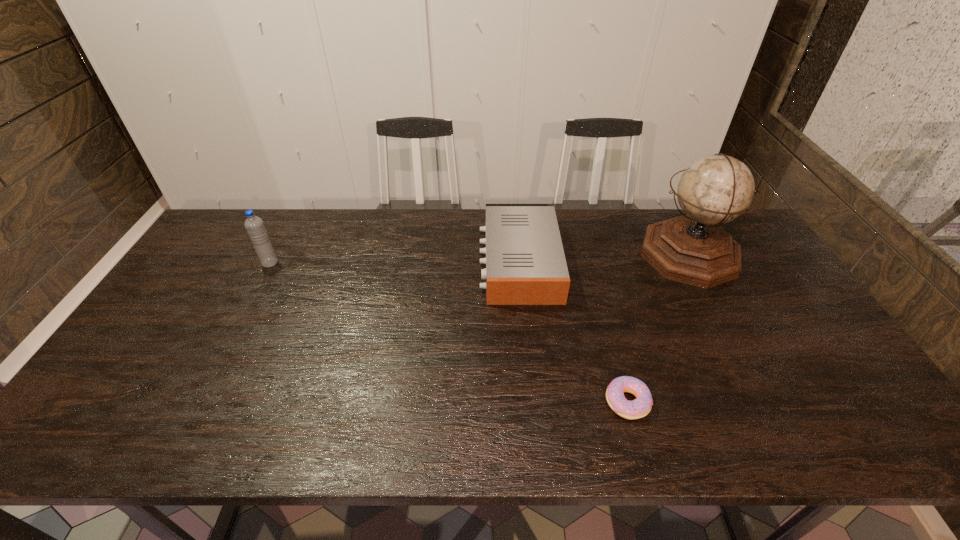
This screenshot has height=540, width=960. What are the coordinates of `object that is positioned at the far right corner` in the screenshot? It's located at (692, 249).

This screenshot has height=540, width=960. I want to click on vacant space at the far edge of the desktop, so [x=334, y=228].

The image size is (960, 540). I want to click on vacant space at the near edge of the desktop, so click(x=525, y=413).

You are a GUI agent. You are given a task and a screenshot of the screen. Output one action in this format:
    pyautogui.click(x=<x>, y=<y>)
    Task: Click on the free spot at the right edge of the desktop
    This screenshot has width=960, height=540.
    Given the screenshot: What is the action you would take?
    tap(804, 348)

Where is `free space at the near left corner of the desktop`? The image size is (960, 540). free space at the near left corner of the desktop is located at coordinates [x=124, y=419].

At what (x,y) coordinates should I click in order to perform the action: click on empty space that is in between the nearest object and the leftmost object. Please return your answer as a coordinate pair (x, y). Looking at the image, I should click on (448, 332).

This screenshot has width=960, height=540. I want to click on empty space that is in between the third shortest object and the globe, so click(x=479, y=259).

The height and width of the screenshot is (540, 960). What are the coordinates of `blank region between the second shortest object and the shortest object` in the screenshot? It's located at (573, 332).

Locate an element on the screen. The image size is (960, 540). empty location between the water bottle and the third object from right to left is located at coordinates (395, 262).

Where is `empty location between the rightmost object and the nearest object`? empty location between the rightmost object and the nearest object is located at coordinates (658, 328).